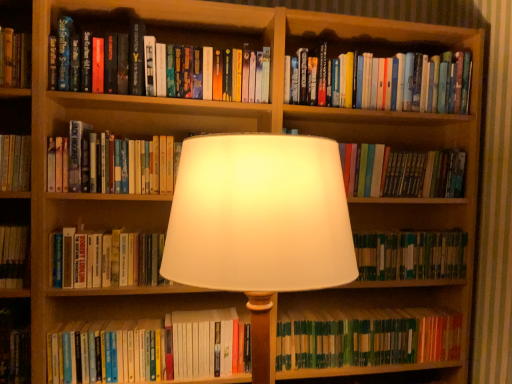
Question: Is hardcover books at upper right, acting as the 2th book starting from the top, a part of hardcover book at center, acting as the sixth book starting from the bottom?

Choices:
 (A) no
 (B) yes

Answer: (A)

Question: Is hardcover book at center, acting as the sixth book starting from the bottom, not within hardcover books at upper right, acting as the 2th book starting from the top?

Choices:
 (A) yes
 (B) no

Answer: (A)

Question: Is hardcover book at center, acting as the sixth book starting from the bottom, placed right next to hardcover books at upper right, the seventh book from the bottom?

Choices:
 (A) no
 (B) yes

Answer: (A)

Question: Does hardcover book at center, which appears as the third book when viewed from the top, appear on the right side of hardcover books at upper right, the seventh book from the bottom?

Choices:
 (A) yes
 (B) no

Answer: (B)

Question: Can you confirm if hardcover book at center, which appears as the third book when viewed from the top, is bigger than hardcover books at upper right, the seventh book from the bottom?

Choices:
 (A) no
 (B) yes

Answer: (B)

Question: Does hardcover book at center, which appears as the third book when viewed from the top, lie in front of hardcover books at upper right, the seventh book from the bottom?

Choices:
 (A) no
 (B) yes

Answer: (B)

Question: From a real-world perspective, is white fabric lampshade at center below green matte book at lower right, arranged as the first book when ordered from the bottom?

Choices:
 (A) yes
 (B) no

Answer: (B)

Question: Is white fabric lampshade at center with green matte book at lower right, the 8th book positioned from the top?

Choices:
 (A) no
 (B) yes

Answer: (A)

Question: Considering the relative positions of white fabric lampshade at center and green matte book at lower right, the 8th book positioned from the top, in the image provided, is white fabric lampshade at center to the left of green matte book at lower right, the 8th book positioned from the top, from the viewer's perspective?

Choices:
 (A) yes
 (B) no

Answer: (A)

Question: From a real-world perspective, is white fabric lampshade at center positioned over green matte book at lower right, the 8th book positioned from the top, based on gravity?

Choices:
 (A) yes
 (B) no

Answer: (A)

Question: Does white fabric lampshade at center come in front of green matte book at lower right, the 8th book positioned from the top?

Choices:
 (A) no
 (B) yes

Answer: (B)

Question: Does white fabric lampshade at center have a larger size compared to green matte book at lower right, arranged as the first book when ordered from the bottom?

Choices:
 (A) no
 (B) yes

Answer: (B)

Question: From the image's perspective, is green matte book at lower right, arranged as the first book when ordered from the bottom, under hardcover book at center, which appears as the third book when viewed from the top?

Choices:
 (A) no
 (B) yes

Answer: (B)